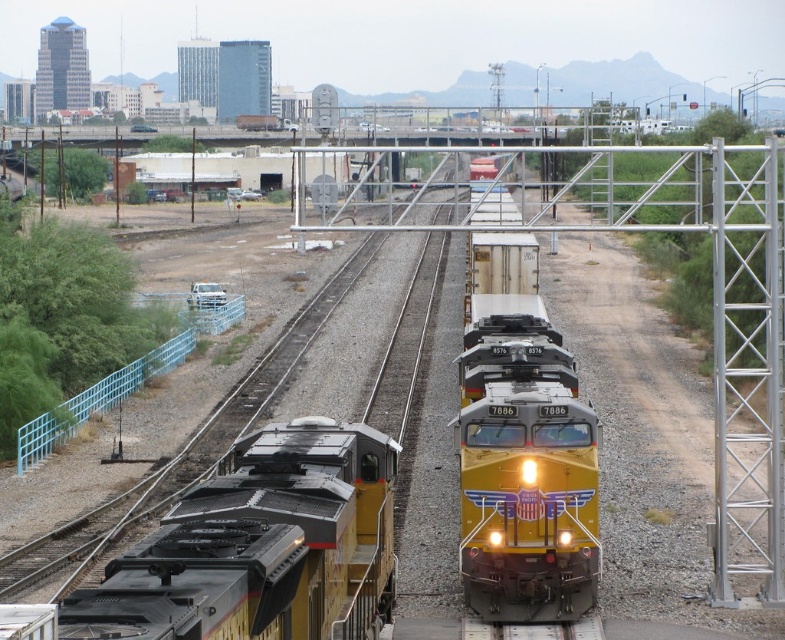
Question: Which of the following is the farthest from the observer?

Choices:
 (A) (553, 497)
 (B) (183, 506)

Answer: (A)

Question: From the image, what is the correct spatial relationship of yellow matte train car at lower left in relation to yellow metallic train at center?

Choices:
 (A) right
 (B) left

Answer: (B)

Question: From the image, what is the correct spatial relationship of yellow matte train car at lower left in relation to yellow metallic train at center?

Choices:
 (A) right
 (B) left

Answer: (B)

Question: Is yellow matte train car at lower left to the right of yellow metallic train at center from the viewer's perspective?

Choices:
 (A) yes
 (B) no

Answer: (B)